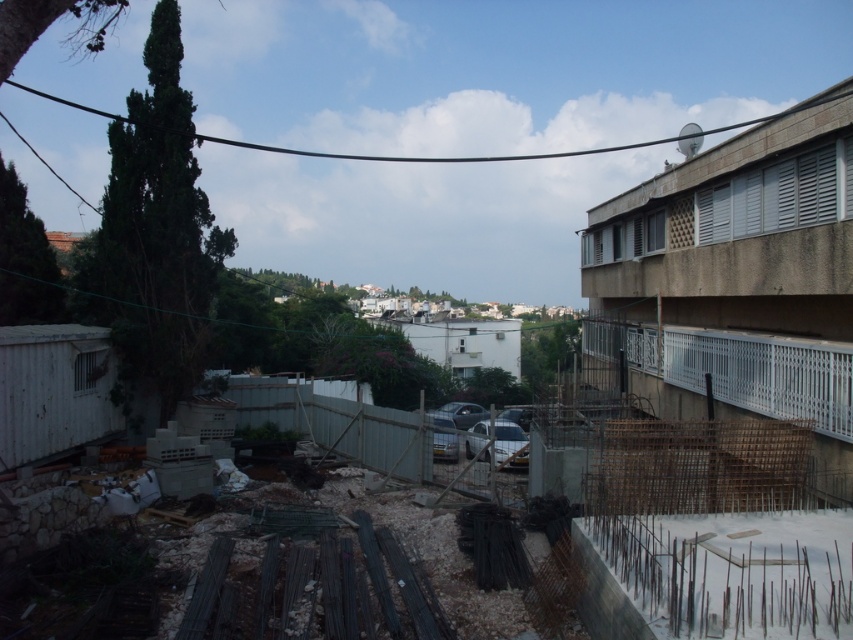
Is point (498, 451) closer to viewer compared to point (451, 451)?

No, it is not.

Which is in front, point (502, 426) or point (436, 451)?

Positioned in front is point (436, 451).

The height and width of the screenshot is (640, 853). In order to click on white glossy car at center in this screenshot , I will do `click(503, 442)`.

Looking at this image, is white metal fence at right above metallic silver car at center?

Indeed, white metal fence at right is positioned over metallic silver car at center.

Does white metal fence at right have a lesser width compared to metallic silver car at center?

No, white metal fence at right is not thinner than metallic silver car at center.

The width and height of the screenshot is (853, 640). I want to click on white metal fence at right, so click(x=740, y=369).

What do you see at coordinates (740, 369) in the screenshot? The image size is (853, 640). I see `white metal fence at right` at bounding box center [740, 369].

I want to click on white metal fence at right, so click(x=740, y=369).

This screenshot has width=853, height=640. In order to click on white metal fence at right in this screenshot , I will do `click(740, 369)`.